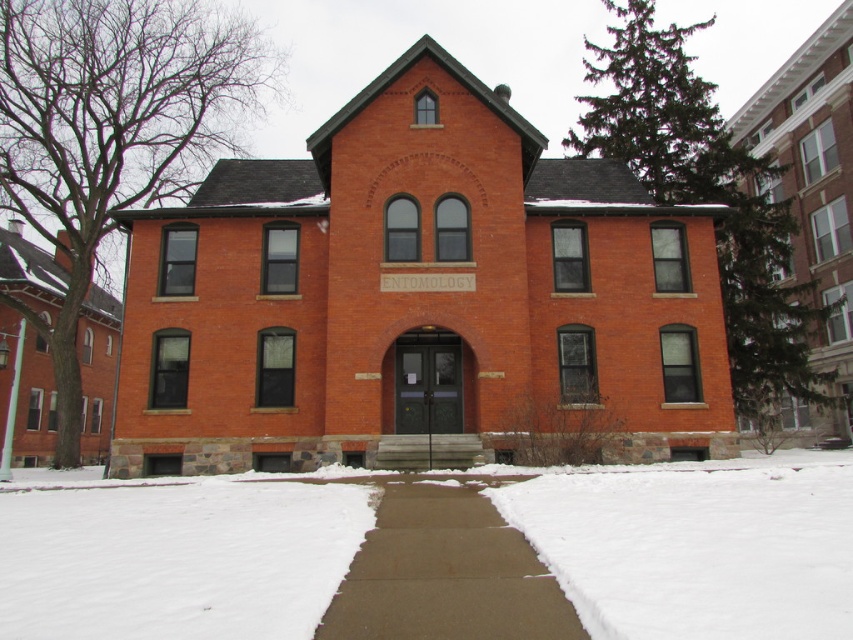
Question: Which object appears farthest from the camera in this image?

Choices:
 (A) concrete at center
 (B) white powdery snow at center

Answer: (A)

Question: Is white powdery snow at center further to the viewer compared to concrete at center?

Choices:
 (A) no
 (B) yes

Answer: (A)

Question: Does white powdery snow at center appear on the right side of concrete at center?

Choices:
 (A) yes
 (B) no

Answer: (A)

Question: Is white powdery snow at center wider than concrete at center?

Choices:
 (A) no
 (B) yes

Answer: (B)